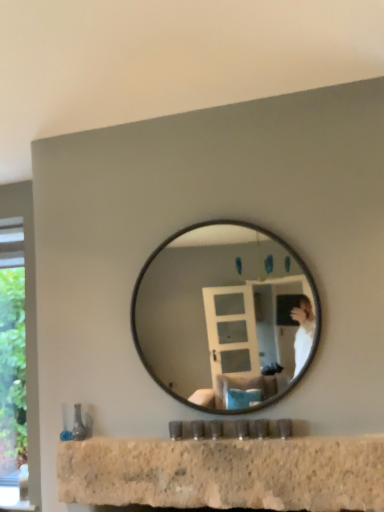
Question: From the image's perspective, is black glass mirror at center below granite countertop at lower center?

Choices:
 (A) no
 (B) yes

Answer: (A)

Question: Is black glass mirror at center closer to camera compared to granite countertop at lower center?

Choices:
 (A) no
 (B) yes

Answer: (A)

Question: From a real-world perspective, is black glass mirror at center located beneath granite countertop at lower center?

Choices:
 (A) no
 (B) yes

Answer: (A)

Question: Is black glass mirror at center directly adjacent to granite countertop at lower center?

Choices:
 (A) yes
 (B) no

Answer: (B)

Question: Considering the relative sizes of black glass mirror at center and granite countertop at lower center in the image provided, is black glass mirror at center smaller than granite countertop at lower center?

Choices:
 (A) yes
 (B) no

Answer: (B)

Question: Considering the relative sizes of black glass mirror at center and granite countertop at lower center in the image provided, is black glass mirror at center wider than granite countertop at lower center?

Choices:
 (A) no
 (B) yes

Answer: (B)

Question: Does granite countertop at lower center appear on the left side of black glass mirror at center?

Choices:
 (A) yes
 (B) no

Answer: (A)

Question: Considering the relative sizes of granite countertop at lower center and black glass mirror at center in the image provided, is granite countertop at lower center thinner than black glass mirror at center?

Choices:
 (A) no
 (B) yes

Answer: (B)

Question: Is granite countertop at lower center bigger than black glass mirror at center?

Choices:
 (A) yes
 (B) no

Answer: (B)

Question: Can you confirm if granite countertop at lower center is smaller than black glass mirror at center?

Choices:
 (A) no
 (B) yes

Answer: (B)

Question: Does granite countertop at lower center have a greater width compared to black glass mirror at center?

Choices:
 (A) yes
 (B) no

Answer: (B)

Question: From the image's perspective, is granite countertop at lower center on black glass mirror at center?

Choices:
 (A) no
 (B) yes

Answer: (A)

Question: From a real-world perspective, is black glass mirror at center above or below granite countertop at lower center?

Choices:
 (A) below
 (B) above

Answer: (B)